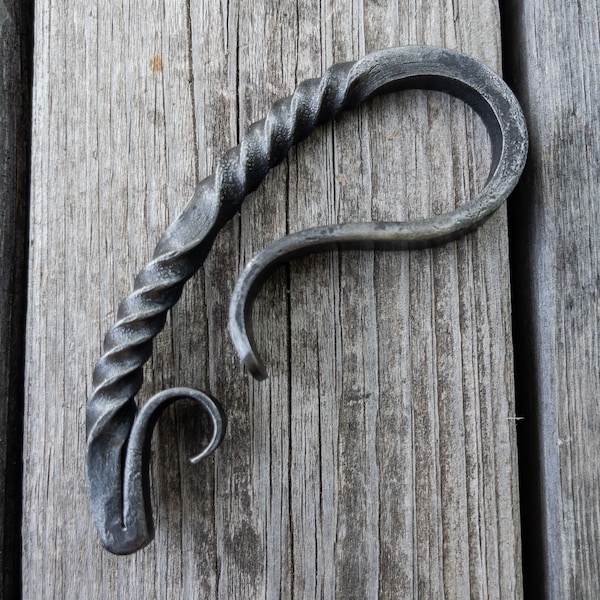
I want to click on cracks in wood, so click(x=290, y=504), click(x=212, y=509), click(x=181, y=516), click(x=287, y=203), click(x=237, y=227), click(x=202, y=290), click(x=189, y=81), click(x=238, y=89), click(x=321, y=40).